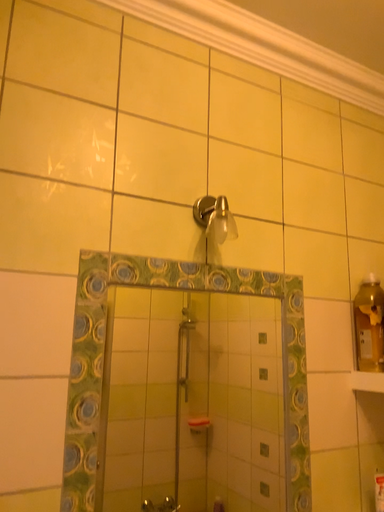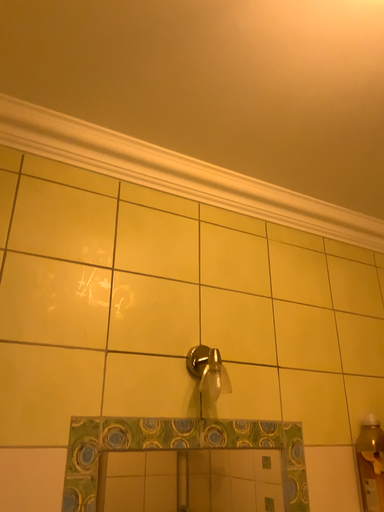
Question: How did the camera likely rotate when shooting the video?

Choices:
 (A) rotated downward
 (B) rotated upward

Answer: (B)